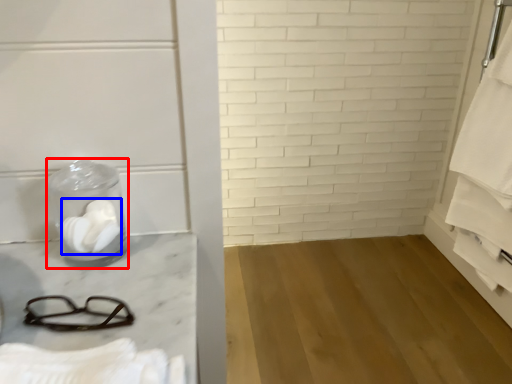
Question: Which point is closer to the camera, glass jar (highlighted by a red box) or toilet paper (highlighted by a blue box)?

Choices:
 (A) glass jar
 (B) toilet paper

Answer: (A)